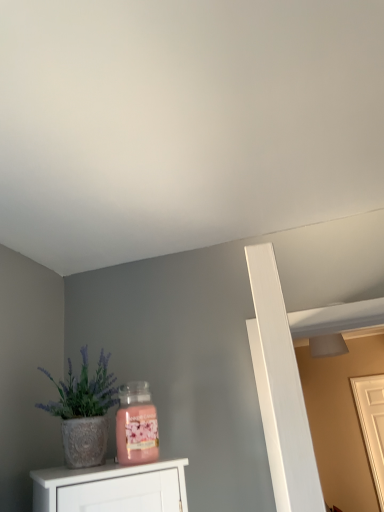
Question: Does textured white pot at left have a smaller size compared to white wooden door at right?

Choices:
 (A) yes
 (B) no

Answer: (A)

Question: Is textured white pot at left bigger than white wooden door at right?

Choices:
 (A) yes
 (B) no

Answer: (B)

Question: Can you confirm if textured white pot at left is thinner than white wooden door at right?

Choices:
 (A) no
 (B) yes

Answer: (A)

Question: Is the surface of textured white pot at left in direct contact with white wooden door at right?

Choices:
 (A) yes
 (B) no

Answer: (B)

Question: Does textured white pot at left contain white wooden door at right?

Choices:
 (A) no
 (B) yes

Answer: (A)

Question: Is textured white pot at left shorter than white wooden door at right?

Choices:
 (A) no
 (B) yes

Answer: (B)

Question: From the image's perspective, would you say white wooden door at right is shown under textured white pot at left?

Choices:
 (A) no
 (B) yes

Answer: (B)

Question: From a real-world perspective, is white wooden door at right on textured white pot at left?

Choices:
 (A) no
 (B) yes

Answer: (A)

Question: From the image's perspective, is white wooden door at right on top of textured white pot at left?

Choices:
 (A) no
 (B) yes

Answer: (A)

Question: Can you confirm if white wooden door at right is bigger than textured white pot at left?

Choices:
 (A) no
 (B) yes

Answer: (B)

Question: Is white wooden door at right in contact with textured white pot at left?

Choices:
 (A) no
 (B) yes

Answer: (A)

Question: Does white wooden door at right appear on the right side of textured white pot at left?

Choices:
 (A) no
 (B) yes

Answer: (B)

Question: Would you say textured white pot at left is to the left or to the right of white wooden door at right in the picture?

Choices:
 (A) left
 (B) right

Answer: (A)